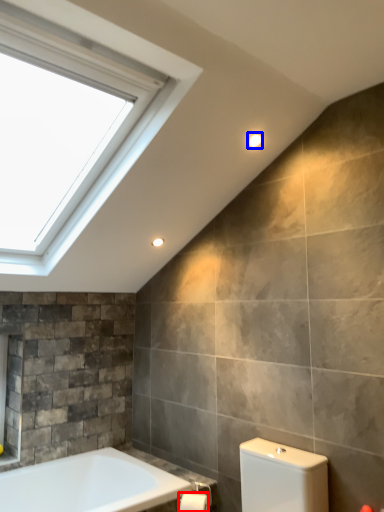
Question: Among these objects, which one is farthest to the camera, toilet paper (highlighted by a red box) or light fixture (highlighted by a blue box)?

Choices:
 (A) toilet paper
 (B) light fixture

Answer: (B)